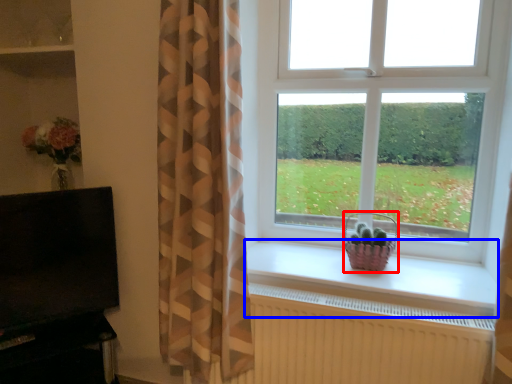
Question: Which object is closer to the camera taking this photo, basket (highlighted by a red box) or window sill (highlighted by a blue box)?

Choices:
 (A) basket
 (B) window sill

Answer: (B)